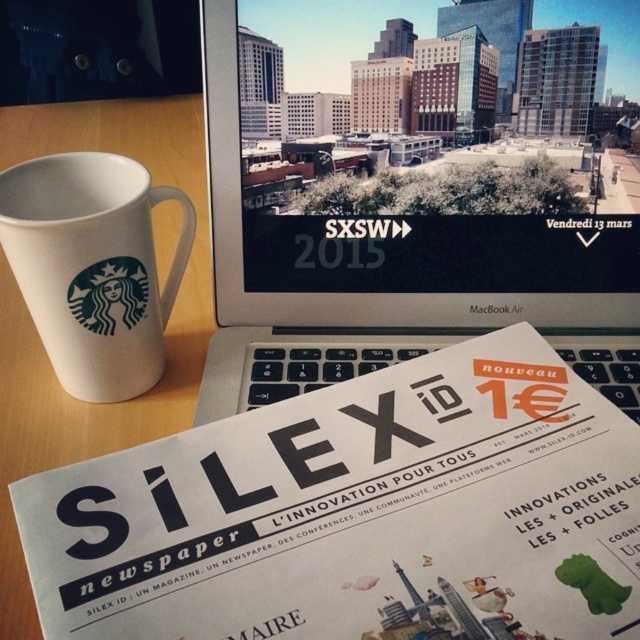
Question: Based on their relative distances, which object is nearer to the white ceramic mug at left?

Choices:
 (A) silver metallic laptop at center
 (B) white glossy newspaper at center

Answer: (A)

Question: Which of the following is the closest to the observer?

Choices:
 (A) (300, 582)
 (B) (131, 387)
 (C) (337, 353)

Answer: (A)

Question: Does silver metallic laptop at center have a greater width compared to white ceramic mug at left?

Choices:
 (A) yes
 (B) no

Answer: (A)

Question: Observing the image, what is the correct spatial positioning of white glossy newspaper at center in reference to white ceramic mug at left?

Choices:
 (A) above
 (B) below

Answer: (B)

Question: Considering the real-world distances, which object is farthest from the white glossy newspaper at center?

Choices:
 (A) white ceramic mug at left
 (B) silver metallic laptop at center

Answer: (A)

Question: Does white glossy newspaper at center appear over white ceramic mug at left?

Choices:
 (A) no
 (B) yes

Answer: (A)